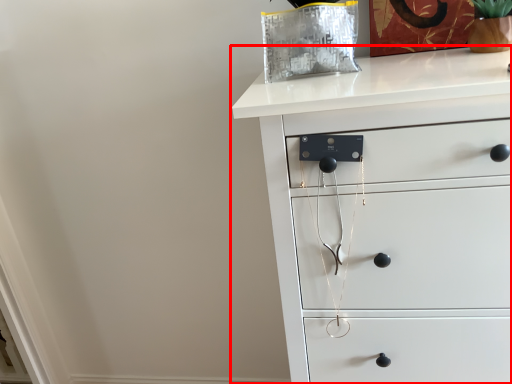
Question: In this image, where is chest of drawers (annotated by the red box) located relative to glass vase?

Choices:
 (A) left
 (B) right

Answer: (A)